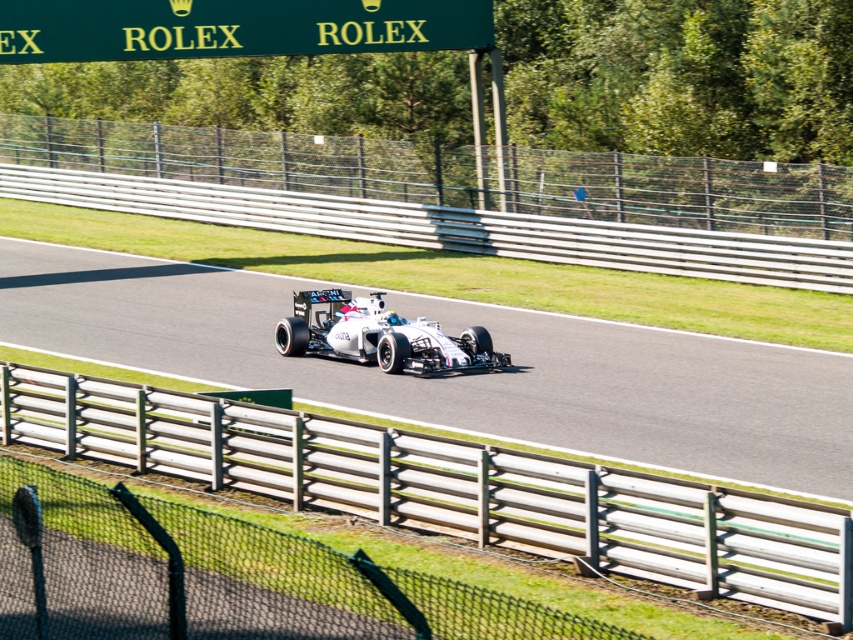
Question: From the image, what is the correct spatial relationship of white asphalt race track at center in relation to green sign at upper center?

Choices:
 (A) above
 (B) below

Answer: (B)

Question: Can you confirm if white asphalt race track at center is positioned to the right of white metallic race car at center?

Choices:
 (A) no
 (B) yes

Answer: (A)

Question: Which is nearer to the white asphalt race track at center?

Choices:
 (A) green sign at upper center
 (B) white metallic race car at center

Answer: (B)

Question: Which object is positioned closest to the green sign at upper center?

Choices:
 (A) white asphalt race track at center
 (B) white metallic race car at center

Answer: (A)

Question: From the image, what is the correct spatial relationship of white asphalt race track at center in relation to green sign at upper center?

Choices:
 (A) right
 (B) left

Answer: (A)

Question: Which of the following is the farthest from the observer?

Choices:
 (A) (595, 358)
 (B) (379, 321)

Answer: (A)